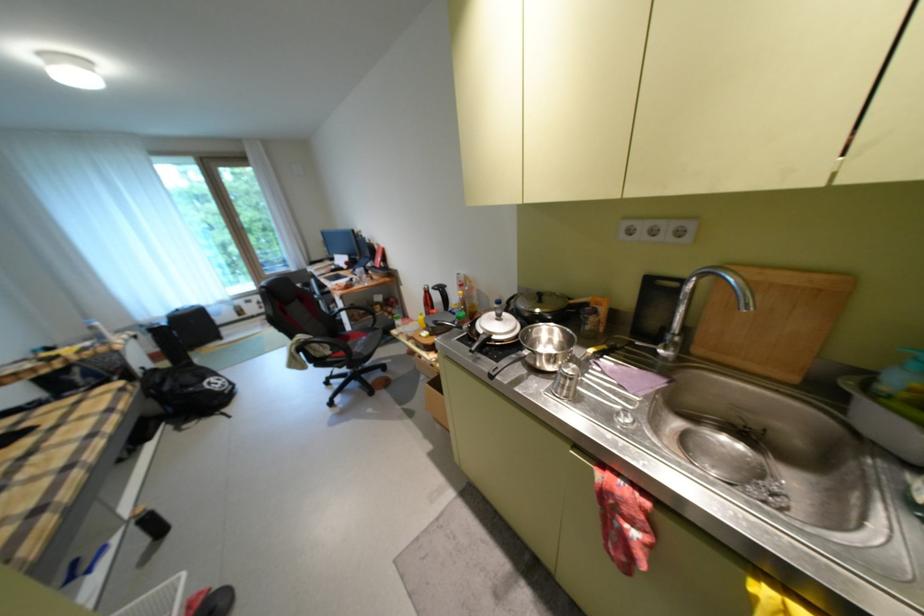
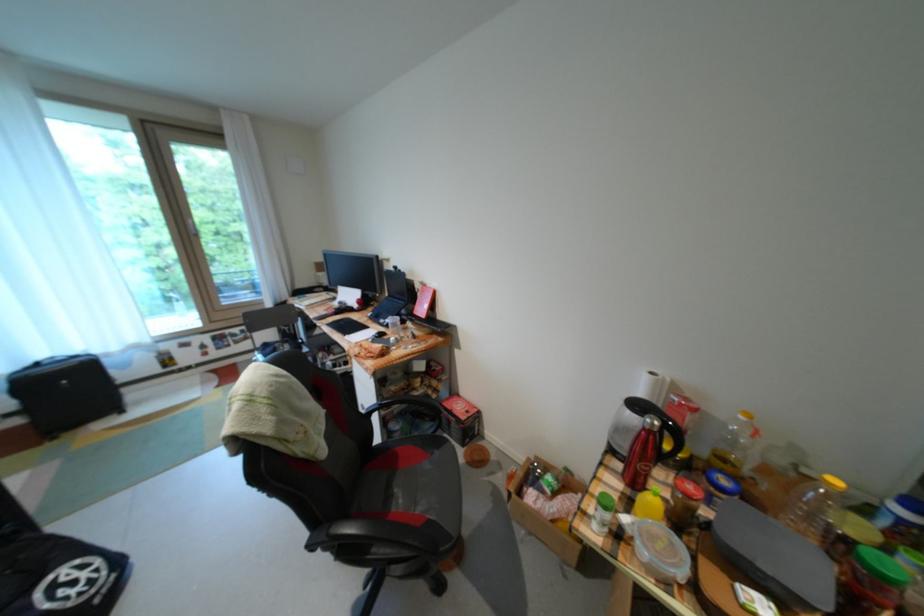
Where in the second image is the point corresponding to point 381,334 from the first image?

(446, 455)